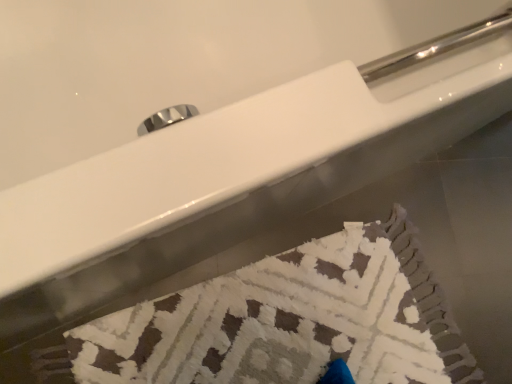
Where is `vacant area on top of white textured bath towel at lower center (from a real-world perspective)`? This screenshot has width=512, height=384. vacant area on top of white textured bath towel at lower center (from a real-world perspective) is located at coordinates (283, 334).